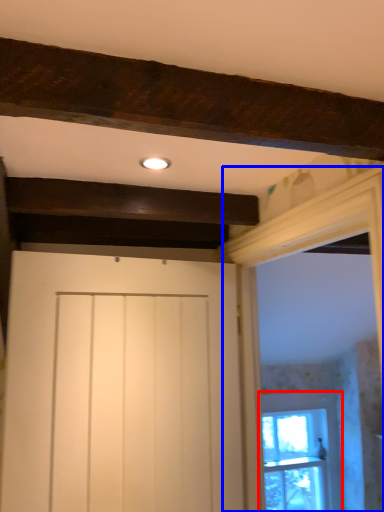
Question: Among these objects, which one is nearest to the camera, window (highlighted by a red box) or window frame (highlighted by a blue box)?

Choices:
 (A) window
 (B) window frame

Answer: (B)